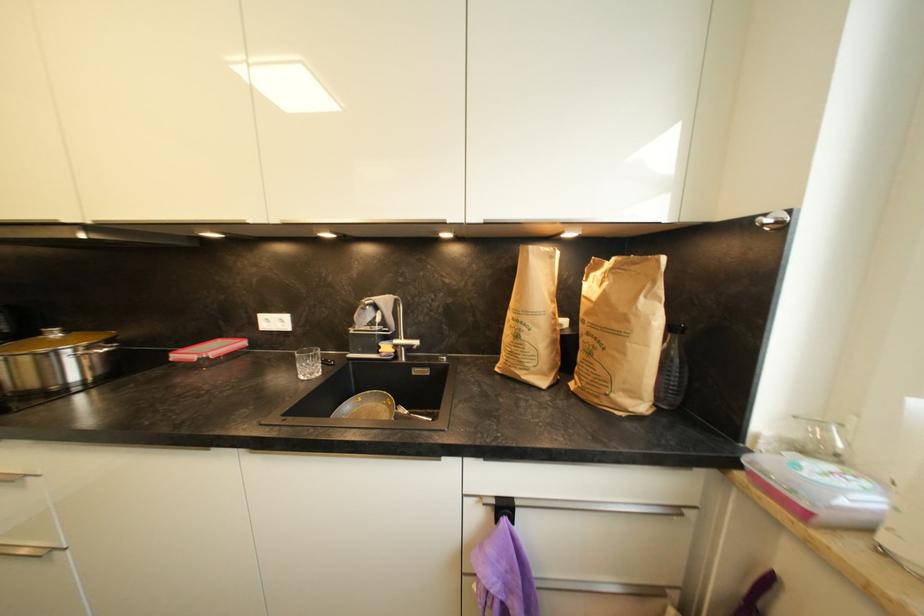
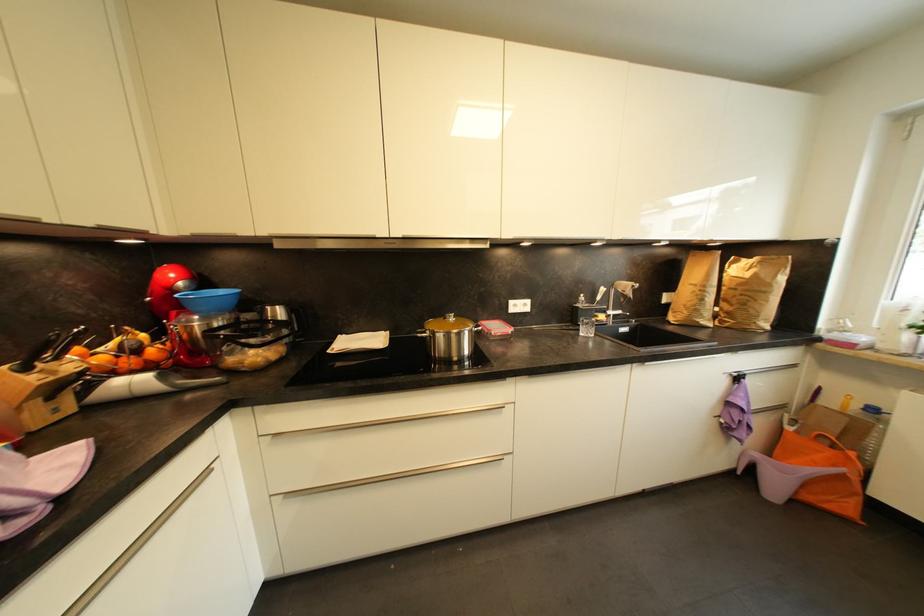
Question: In a continuous first-person perspective shot, in which direction is the camera moving?

Choices:
 (A) Left
 (B) Right
 (C) Forward
 (D) Backward

Answer: (A)